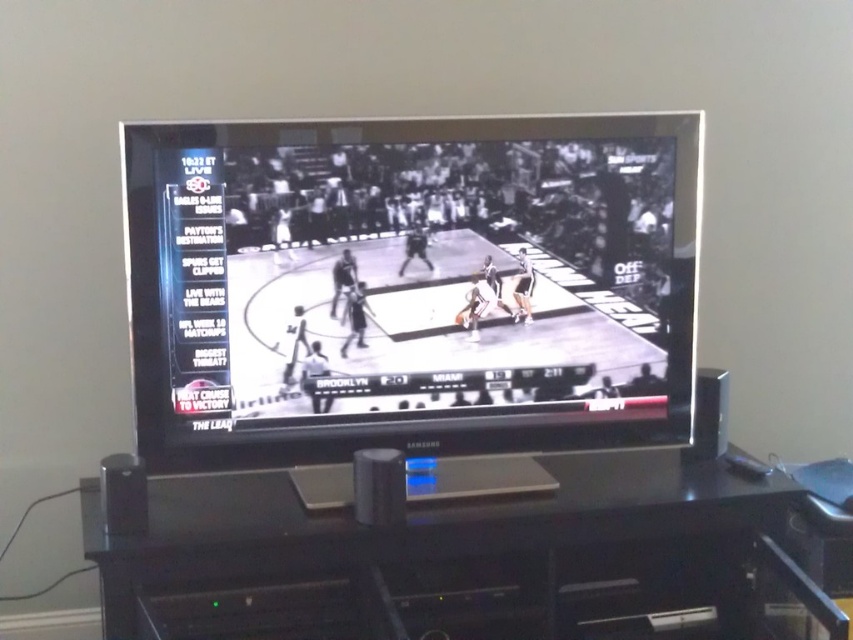
Question: Which point is closer to the camera?

Choices:
 (A) black plastic entertainment center at lower center
 (B) black glossy basketball court at center

Answer: (A)

Question: Does black glossy basketball court at center have a greater width compared to black plastic entertainment center at lower center?

Choices:
 (A) yes
 (B) no

Answer: (B)

Question: Is black glossy basketball court at center positioned in front of black plastic entertainment center at lower center?

Choices:
 (A) no
 (B) yes

Answer: (A)

Question: Among these points, which one is farthest from the camera?

Choices:
 (A) (437, 291)
 (B) (167, 624)

Answer: (A)

Question: Can you confirm if black glossy basketball court at center is positioned above black plastic entertainment center at lower center?

Choices:
 (A) yes
 (B) no

Answer: (A)